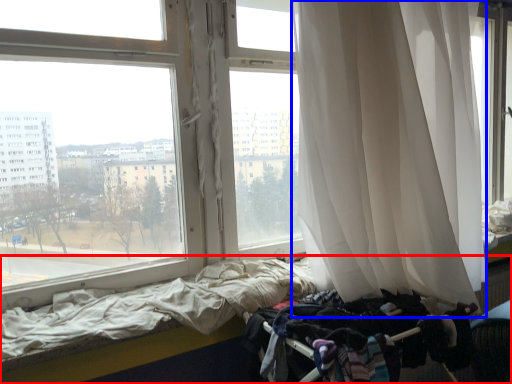
Question: Which object appears farthest to the camera in this image, bed (highlighted by a red box) or curtain (highlighted by a blue box)?

Choices:
 (A) bed
 (B) curtain

Answer: (A)